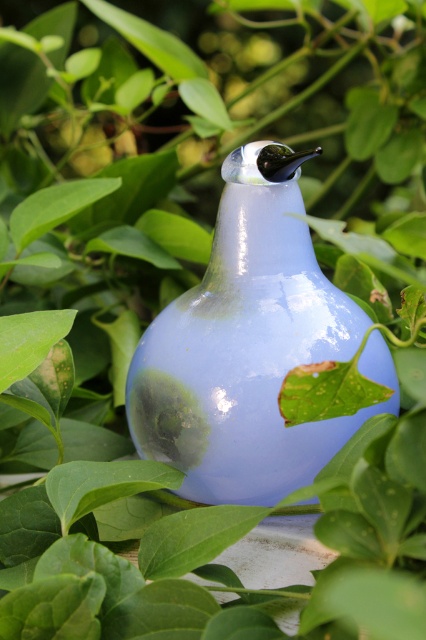
Which of these two, translucent glass vase at center or green glossy leaf at upper left, stands shorter?

Standing shorter between the two is green glossy leaf at upper left.

Locate an element on the screen. Image resolution: width=426 pixels, height=640 pixels. translucent glass vase at center is located at coordinates (249, 348).

The height and width of the screenshot is (640, 426). I want to click on translucent glass vase at center, so click(x=249, y=348).

In the scene shown: Who is more forward, (60, 465) or (3, 320)?

Point (60, 465) is in front.

Does point (72, 465) come behind point (63, 326)?

Yes, it is behind point (63, 326).

I want to click on green glossy leaf at lower left, so click(103, 484).

The image size is (426, 640). Describe the element at coordinates (54, 208) in the screenshot. I see `green glossy leaf at upper left` at that location.

Between green glossy leaf at upper left and green matte leaf at lower left, which one appears on the right side from the viewer's perspective?

green matte leaf at lower left

Between point (36, 204) and point (8, 321), which one is positioned in front?

Point (8, 321)

Where is `green glossy leaf at upper left`? green glossy leaf at upper left is located at coordinates (x=54, y=208).